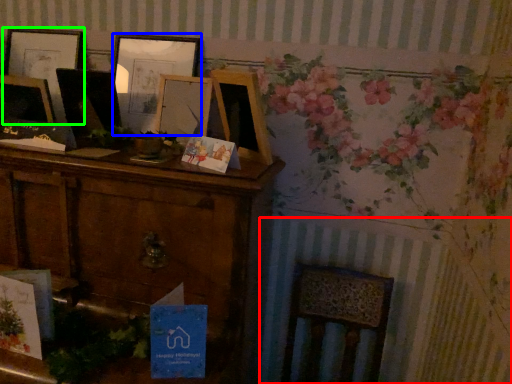
Question: Which is nearer to the radiator (highlighted by a red box)? picture frame (highlighted by a blue box) or picture frame (highlighted by a green box).

Choices:
 (A) picture frame
 (B) picture frame

Answer: (A)